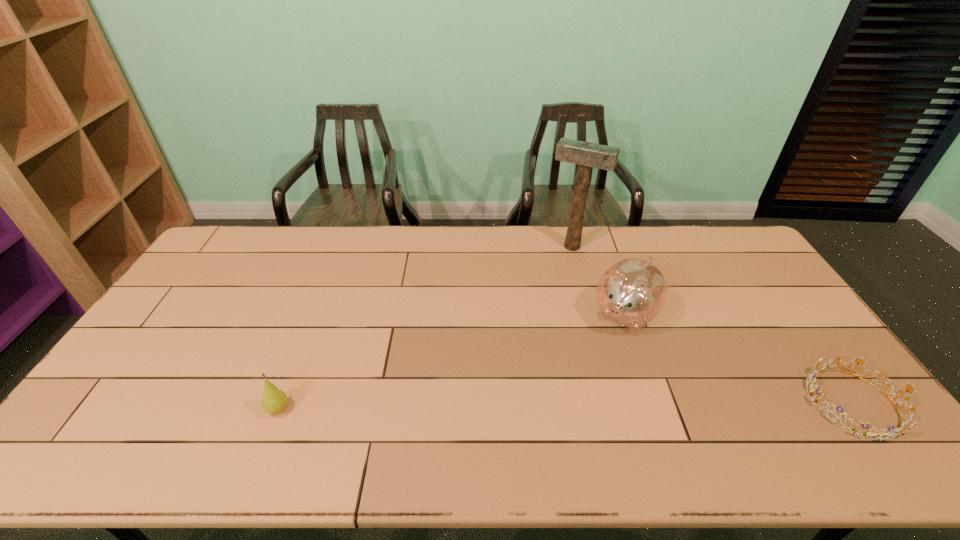
Where is `the third tallest object`? the third tallest object is located at coordinates (274, 401).

Image resolution: width=960 pixels, height=540 pixels. I want to click on the leftmost object, so click(274, 401).

Image resolution: width=960 pixels, height=540 pixels. I want to click on the rightmost object, so click(908, 416).

Locate an element on the screen. The image size is (960, 540). tiara is located at coordinates (908, 416).

This screenshot has height=540, width=960. Identify the location of the third shortest object. (632, 292).

Where is `piggy bank`? The height and width of the screenshot is (540, 960). piggy bank is located at coordinates (632, 292).

Locate an element on the screen. Image resolution: width=960 pixels, height=540 pixels. the tallest object is located at coordinates (587, 155).

Where is `mallet`? mallet is located at coordinates (587, 155).

Locate an element on the screen. The image size is (960, 540). free space located 0.180m on the left of the leftmost object is located at coordinates (196, 409).

Where is `free space located on the front facing side of the piggy bank`? This screenshot has height=540, width=960. free space located on the front facing side of the piggy bank is located at coordinates (553, 410).